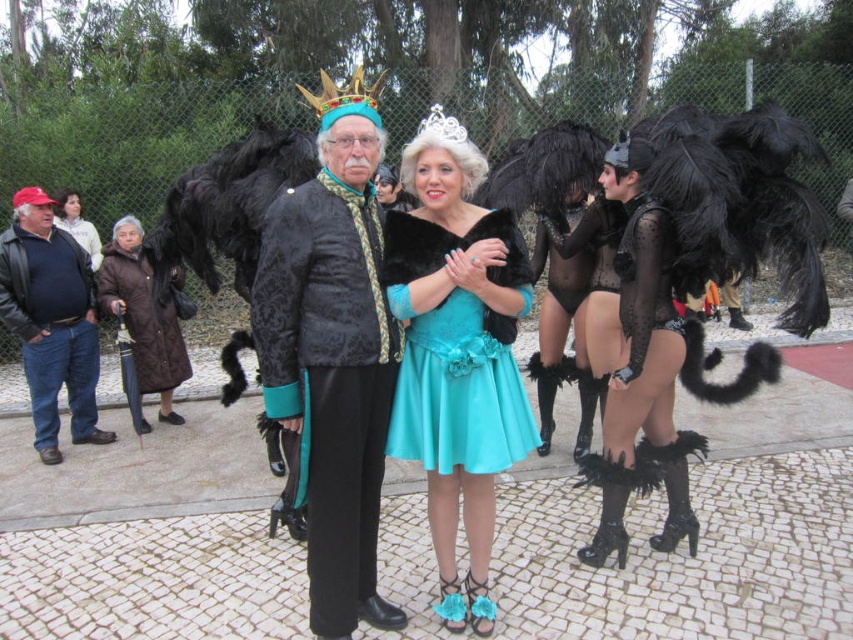
Which is behind, point (483, 216) or point (613, 404)?

Positioned behind is point (613, 404).

Is point (463, 401) in front of point (660, 310)?

Yes, point (463, 401) is in front of point (660, 310).

At what (x,y) coordinates should I click in order to perform the action: click on turquoise satin dress at center. Please return your answer as a coordinate pair (x, y). The image size is (853, 640). Looking at the image, I should click on (456, 353).

Is satin teal dress at center wider than turquoise satin dress at center?

Incorrect, satin teal dress at center's width does not surpass turquoise satin dress at center's.

Who is more distant from viewer, (x=459, y=332) or (x=392, y=444)?

The point (x=392, y=444) is more distant.

What do you see at coordinates (457, 358) in the screenshot?
I see `satin teal dress at center` at bounding box center [457, 358].

Identify the location of satin teal dress at center. (457, 358).

Between denim jeans at left and silver metallic crown at center, which one is positioned lower?

denim jeans at left is lower down.

Between denim jeans at left and silver metallic crown at center, which one appears on the left side from the viewer's perspective?

denim jeans at left is more to the left.

Is point (57, 387) less distant than point (438, 120)?

No, (57, 387) is behind (438, 120).

You are a GUI agent. You are given a task and a screenshot of the screen. Output one action in this format:
    pyautogui.click(x=<x>, y=<y>)
    Task: Click on the denim jeans at left
    The height and width of the screenshot is (640, 853).
    Given the screenshot: What is the action you would take?
    pyautogui.click(x=51, y=321)